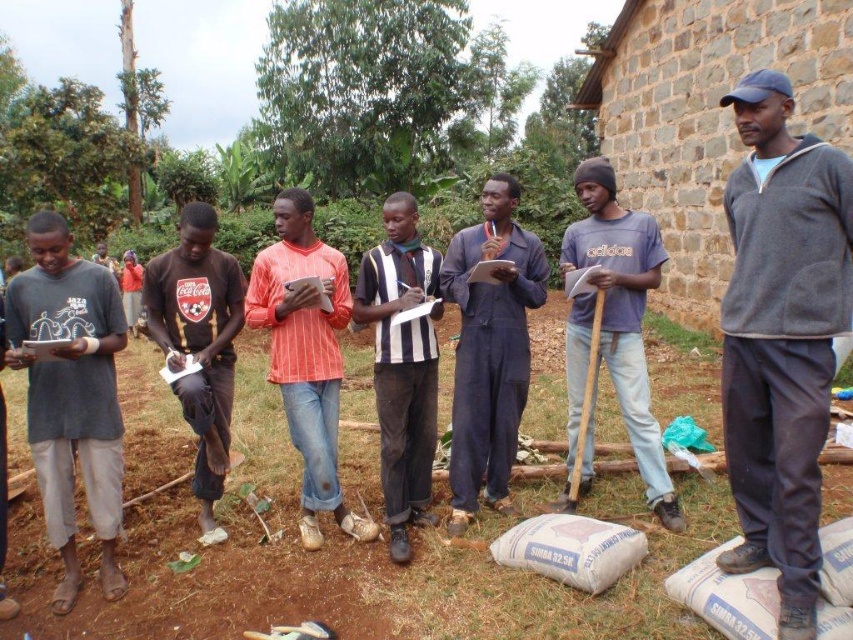
Question: Which point is closer to the camera?

Choices:
 (A) gray cotton shirt at left
 (B) orange striped shirt at center
 (C) brown cotton shirt at center
 (D) striped jersey at center

Answer: (A)

Question: Does gray cotton shirt at left lie behind dark blue jumpsuit at center?

Choices:
 (A) yes
 (B) no

Answer: (B)

Question: Which point is farther to the camera?

Choices:
 (A) (408, 301)
 (B) (596, 362)
 (C) (607, 164)

Answer: (C)

Question: From the image, what is the correct spatial relationship of orange striped shirt at center in relation to gray cotton shirt at center?

Choices:
 (A) below
 (B) above

Answer: (A)

Question: Does orange striped shirt at center have a larger size compared to wooden shovel at center?

Choices:
 (A) yes
 (B) no

Answer: (A)

Question: Which is nearer to the dark blue jumpsuit at center?

Choices:
 (A) gray cotton shirt at center
 (B) brown cotton shirt at center
 (C) gray cotton shirt at left
 (D) gray fleece jacket at center

Answer: (A)